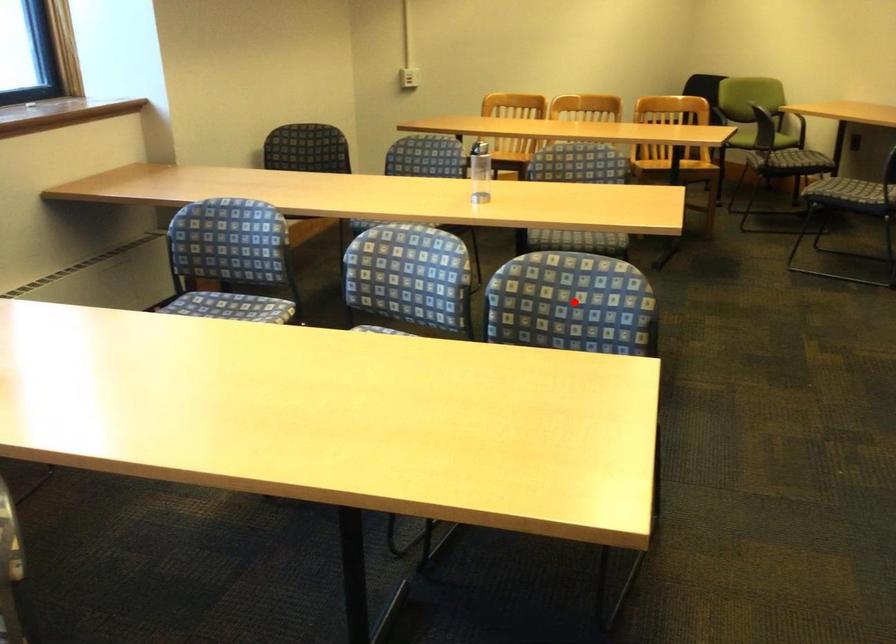
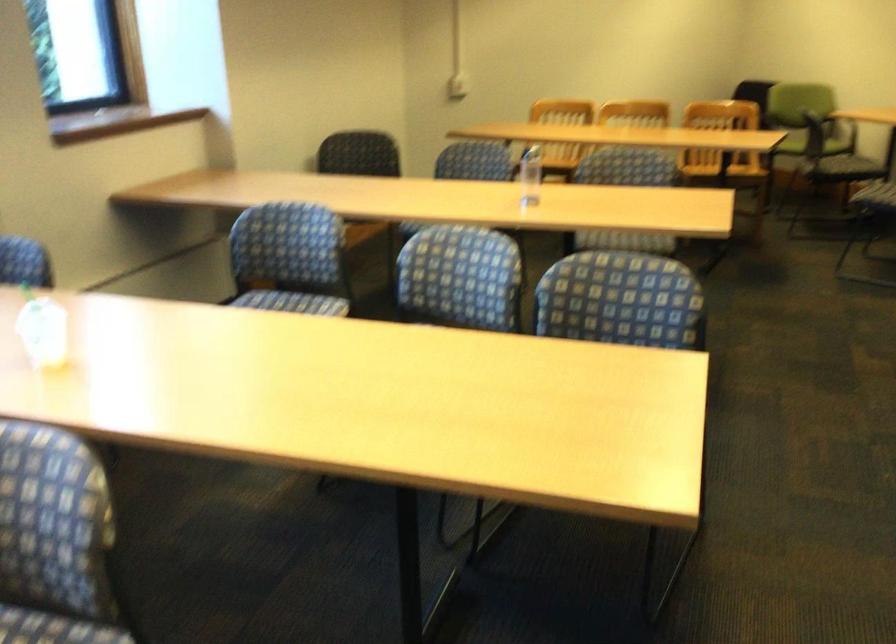
Question: I am providing you with two images of the same scene from different viewpoints. A red point is marked on the first image. Can you still see the location of the red point in image 2?

Choices:
 (A) Yes
 (B) No

Answer: (A)